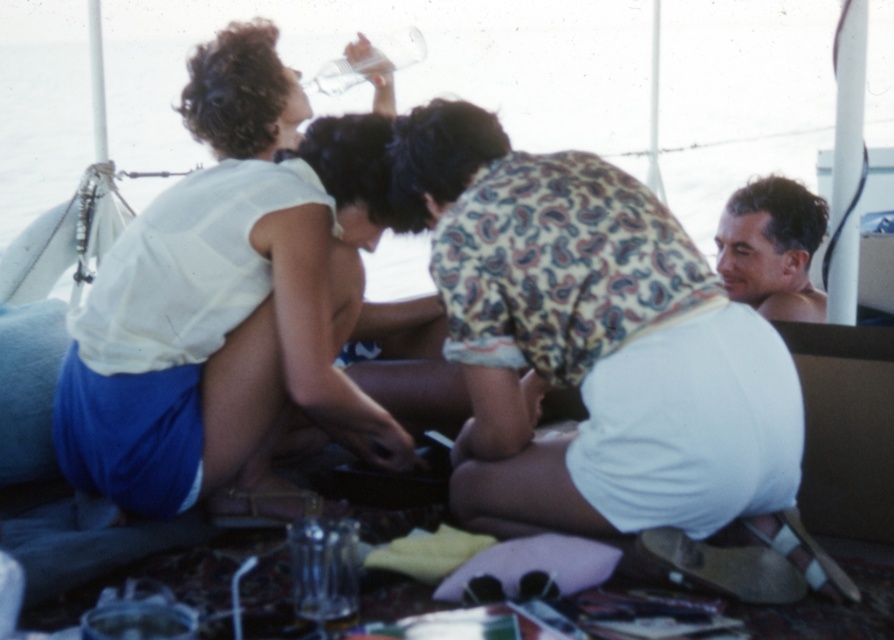
Is white cotton shirt at upper left further to the viewer compared to smooth skin face at upper right?

No, it is not.

Which is more to the left, white cotton shirt at upper left or smooth skin face at upper right?

Positioned to the left is white cotton shirt at upper left.

Which is behind, point (378, 422) or point (763, 266)?

Positioned behind is point (763, 266).

Identify the location of white cotton shirt at upper left. Image resolution: width=894 pixels, height=640 pixels. (222, 307).

Who is more forward, (500, 508) or (739, 248)?

Positioned in front is point (500, 508).

Identify the location of white cotton shirt at center. (591, 340).

Image resolution: width=894 pixels, height=640 pixels. What do you see at coordinates (591, 340) in the screenshot?
I see `white cotton shirt at center` at bounding box center [591, 340].

You are a GUI agent. You are given a task and a screenshot of the screen. Output one action in this format:
    pyautogui.click(x=<x>, y=<y>)
    Task: Click on the white cotton shirt at center
    Image resolution: width=894 pixels, height=640 pixels.
    Given the screenshot: What is the action you would take?
    pyautogui.click(x=591, y=340)

Is white cotton shirt at center positioned behind white cotton shirt at upper left?

No, it is not.

Does white cotton shirt at center have a lesser width compared to white cotton shirt at upper left?

Incorrect, white cotton shirt at center's width is not less than white cotton shirt at upper left's.

Between point (584, 467) and point (257, 458), which one is positioned behind?

The point (257, 458) is more distant.

You are a GUI agent. You are given a task and a screenshot of the screen. Output one action in this format:
    pyautogui.click(x=<x>, y=<y>)
    Task: Click on the white cotton shirt at center
    Image resolution: width=894 pixels, height=640 pixels.
    Given the screenshot: What is the action you would take?
    pyautogui.click(x=591, y=340)